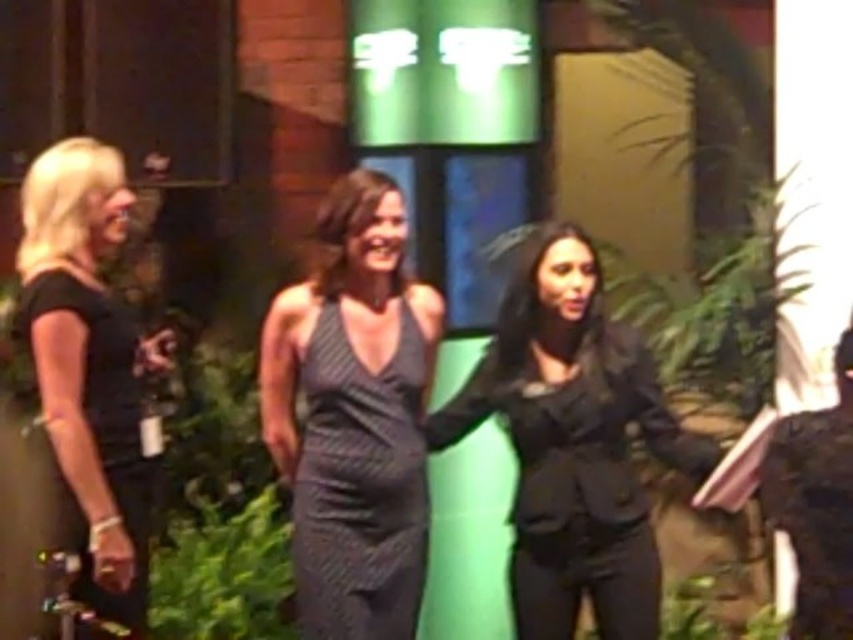
Is point (61, 218) closer to viewer compared to point (805, 500)?

No, (61, 218) is further to viewer.

Is black matte dress at left thinner than dark brown leather jacket at right?

No, black matte dress at left is not thinner than dark brown leather jacket at right.

Identify the location of black matte dress at left. (88, 368).

Is black textured dress at center shorter than dark brown leather jacket at right?

In fact, black textured dress at center may be taller than dark brown leather jacket at right.

Is black textured dress at center further to camera compared to dark brown leather jacket at right?

Yes.

Who is more forward, (373, 624) or (842, 538)?

Positioned in front is point (842, 538).

Locate an element on the screen. black textured dress at center is located at coordinates (360, 486).

Is the position of black matte blazer at center less distant than that of black textured dress at center?

No, black matte blazer at center is behind black textured dress at center.

Where is `black matte blazer at center`? black matte blazer at center is located at coordinates (x=572, y=442).